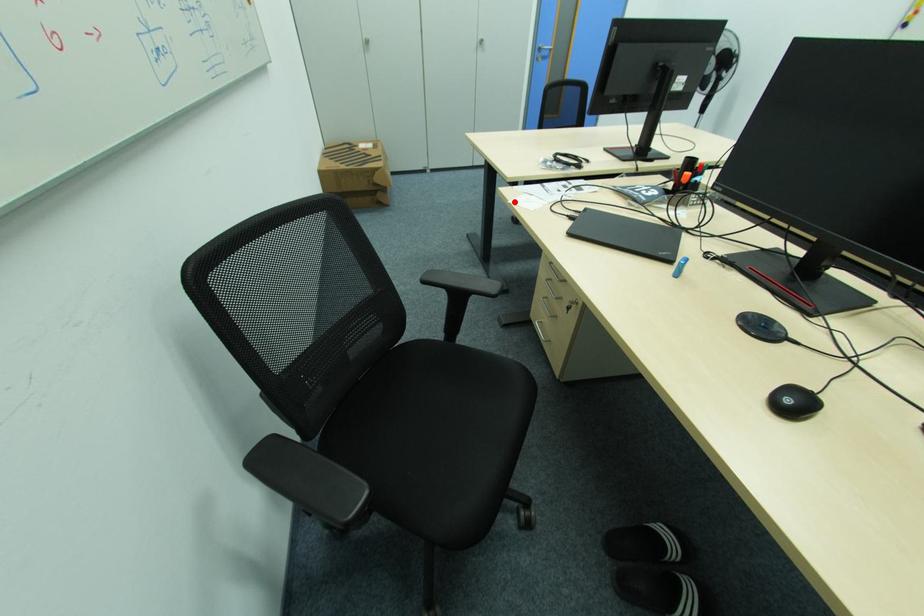
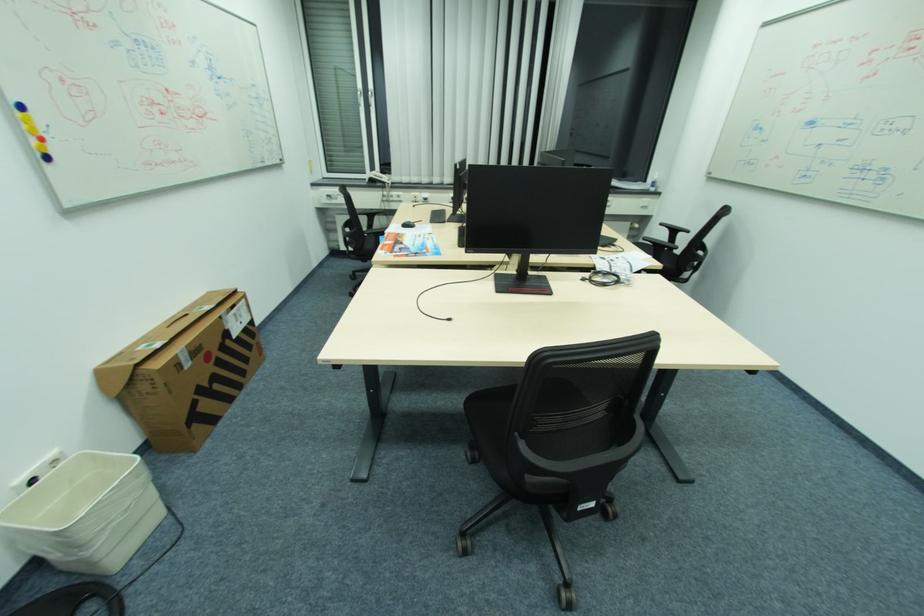
The point at the highlighted location is marked in the first image. Where is the corresponding point in the second image?

(657, 257)